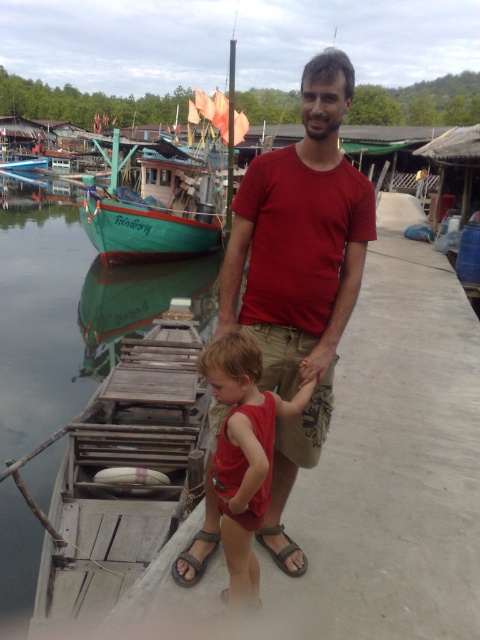
You are a photographer trying to capture both the brown leather sandal at lower center and the brown fabric sandal at lower center in a single frame. Which sandal should you position closer to the edge of the frame to ensure both fit without cropping?

The brown leather sandal at lower center has a lesser width compared to the brown fabric sandal at lower center, so you should position the brown leather sandal at lower center closer to the edge to accommodate both within the frame.